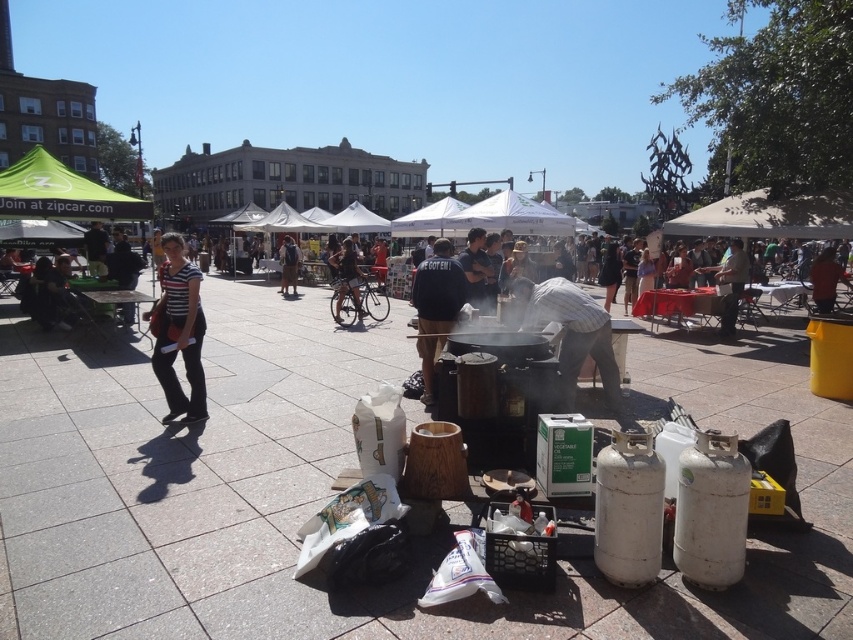
Question: Considering the real-world distances, which object is closest to the dark blue jeans at center?

Choices:
 (A) green fabric canopy at upper left
 (B) gray striped shirt at center

Answer: (A)

Question: Can you confirm if white fabric canopy at center is positioned to the right of dark blue jeans at center?

Choices:
 (A) yes
 (B) no

Answer: (A)

Question: Which object is the closest to the dark blue jacket at center?

Choices:
 (A) white fabric canopy at center
 (B) dark blue jeans at center
 (C) white fabric canopy at upper right

Answer: (A)

Question: Among these objects, which one is nearest to the camera?

Choices:
 (A) white fabric canopy at center
 (B) gray striped shirt at center
 (C) white fabric canopy at upper right

Answer: (B)

Question: Does gray striped shirt at center appear under dark blue jeans at center?

Choices:
 (A) no
 (B) yes

Answer: (B)

Question: Does white fabric canopy at upper right lie in front of dark blue jeans at center?

Choices:
 (A) no
 (B) yes

Answer: (B)